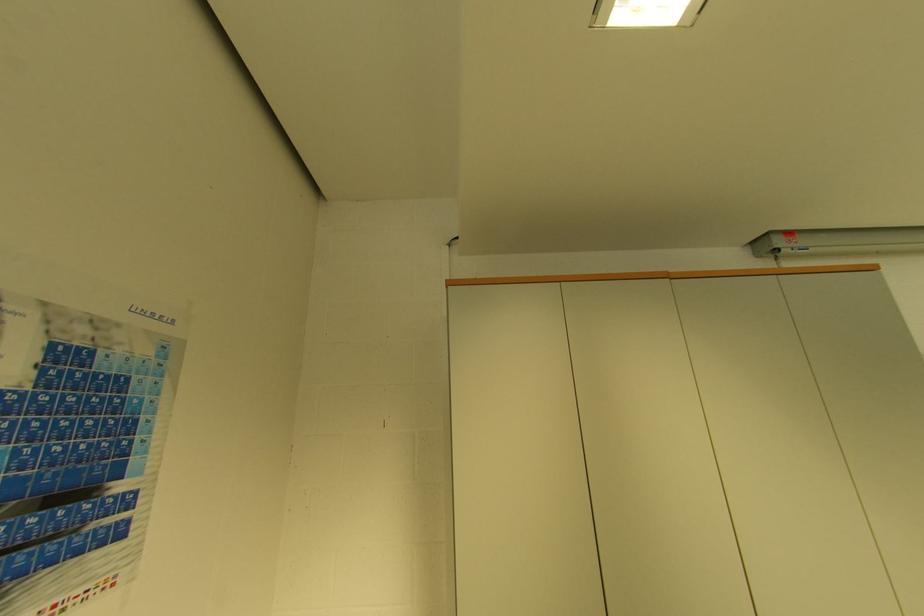
Where is `screen pull cord`? The height and width of the screenshot is (616, 924). screen pull cord is located at coordinates (76, 450).